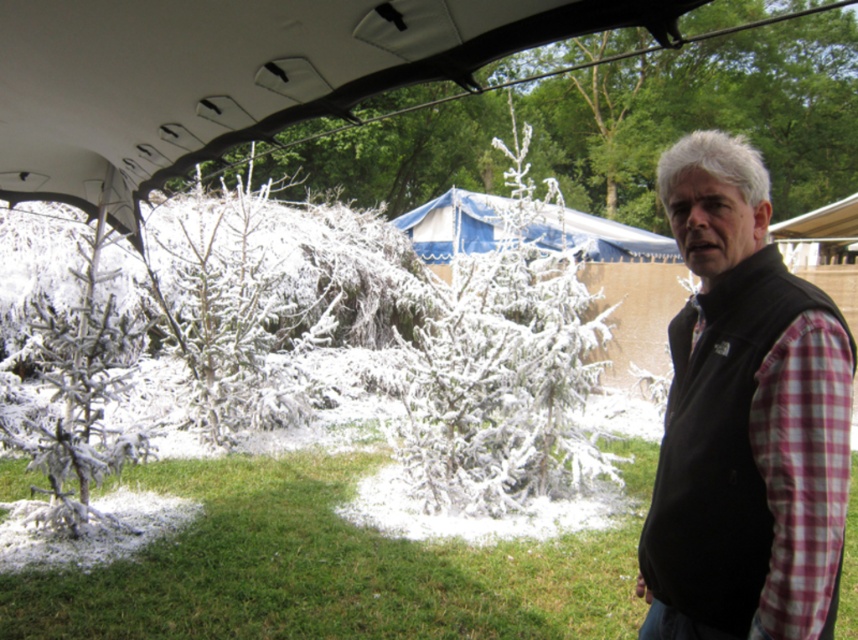
Question: Which point is farther from the camera taking this photo?

Choices:
 (A) (730, 624)
 (B) (636, 237)
 (C) (137, 186)
 (D) (119, 330)

Answer: (B)

Question: Which object is positioned closest to the white matte canopy at upper center?

Choices:
 (A) black fleece vest at right
 (B) white frosty branches at center
 (C) white frosty branches at left
 (D) blue fabric canopy at center

Answer: (C)

Question: From the image, what is the correct spatial relationship of white matte canopy at upper center in relation to blue fabric canopy at center?

Choices:
 (A) right
 (B) left

Answer: (B)

Question: Which object is farther from the camera taking this photo?

Choices:
 (A) blue fabric canopy at center
 (B) white frosty branches at center

Answer: (A)

Question: Does white matte canopy at upper center appear under blue fabric canopy at center?

Choices:
 (A) yes
 (B) no

Answer: (A)

Question: Where is black fleece vest at right located in relation to blue fabric canopy at center in the image?

Choices:
 (A) left
 (B) right

Answer: (A)